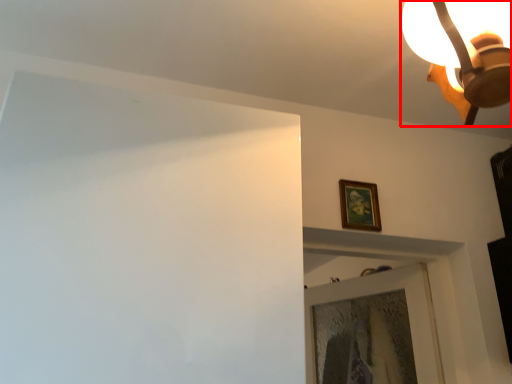
Question: Considering the relative positions of lamp (annotated by the red box) and picture frame in the image provided, where is lamp (annotated by the red box) located with respect to the staircase?

Choices:
 (A) left
 (B) right

Answer: (B)